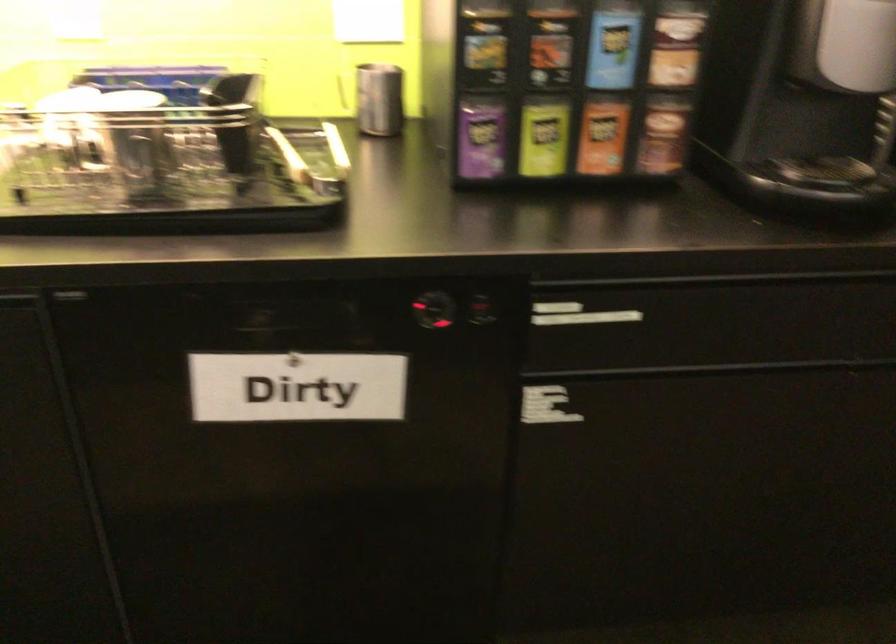
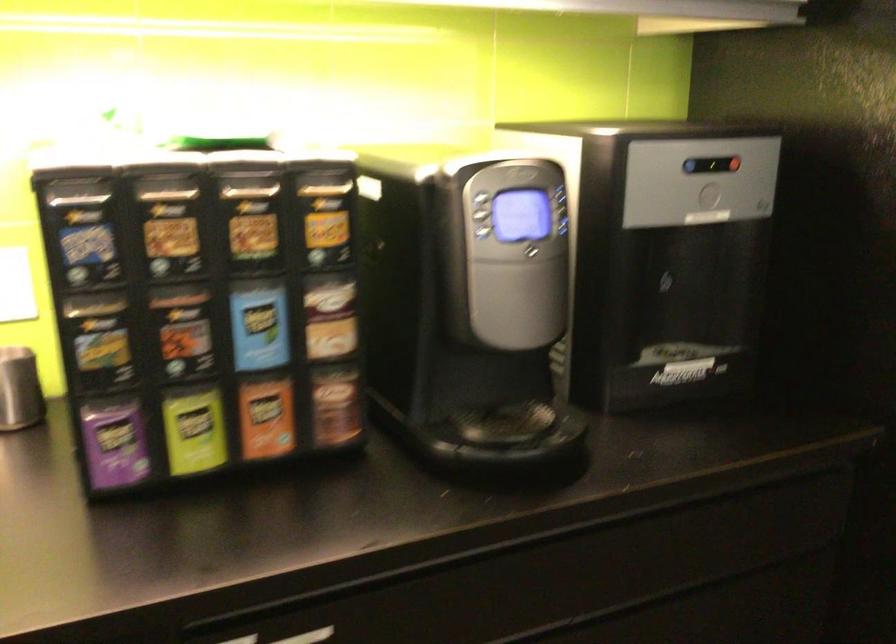
Find the pixel in the second image that matches (664,136) in the first image.

(336, 406)